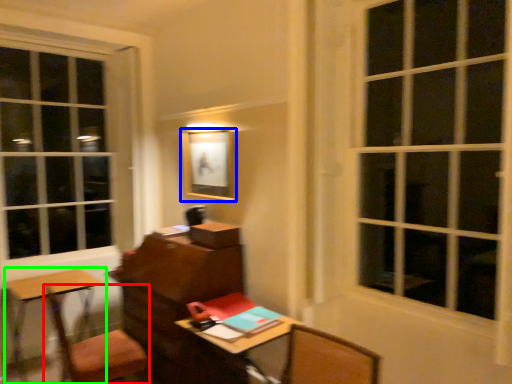
Question: Estimate the real-world distances between objects in this image. Which object is closer to chair (highlighted by a red box), picture frame (highlighted by a blue box) or table (highlighted by a green box)?

Choices:
 (A) picture frame
 (B) table

Answer: (B)